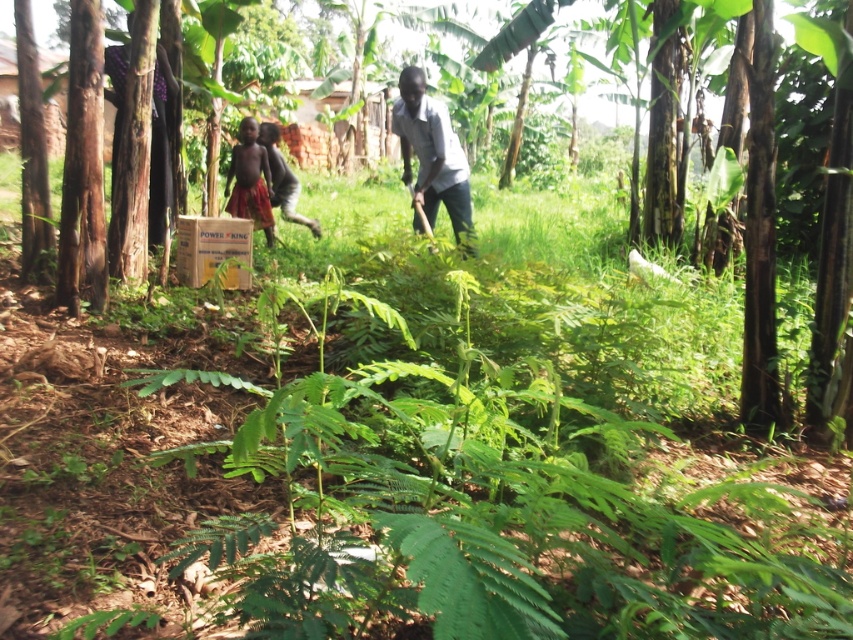
Question: Which of these objects is positioned closest to the bare skin boy at center?

Choices:
 (A) brown textured skirt at center
 (B) gray cotton shirt at center

Answer: (A)

Question: Is gray cotton shirt at center below bare skin boy at center?

Choices:
 (A) yes
 (B) no

Answer: (A)

Question: Is gray cotton shirt at center thinner than brown textured skirt at center?

Choices:
 (A) no
 (B) yes

Answer: (B)

Question: Estimate the real-world distances between objects in this image. Which object is farther from the bare skin boy at center?

Choices:
 (A) gray cotton shirt at center
 (B) brown textured skirt at center

Answer: (A)

Question: Which point is closer to the camera?

Choices:
 (A) gray cotton shirt at center
 (B) brown textured skirt at center

Answer: (A)

Question: Can you confirm if brown textured skirt at center is smaller than bare skin boy at center?

Choices:
 (A) no
 (B) yes

Answer: (A)